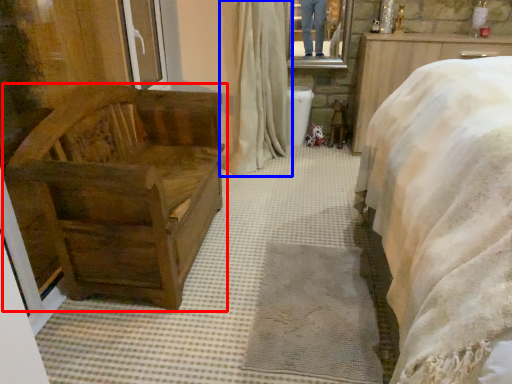
Question: Among these objects, which one is nearest to the camera, furniture (highlighted by a red box) or curtain (highlighted by a blue box)?

Choices:
 (A) furniture
 (B) curtain

Answer: (A)